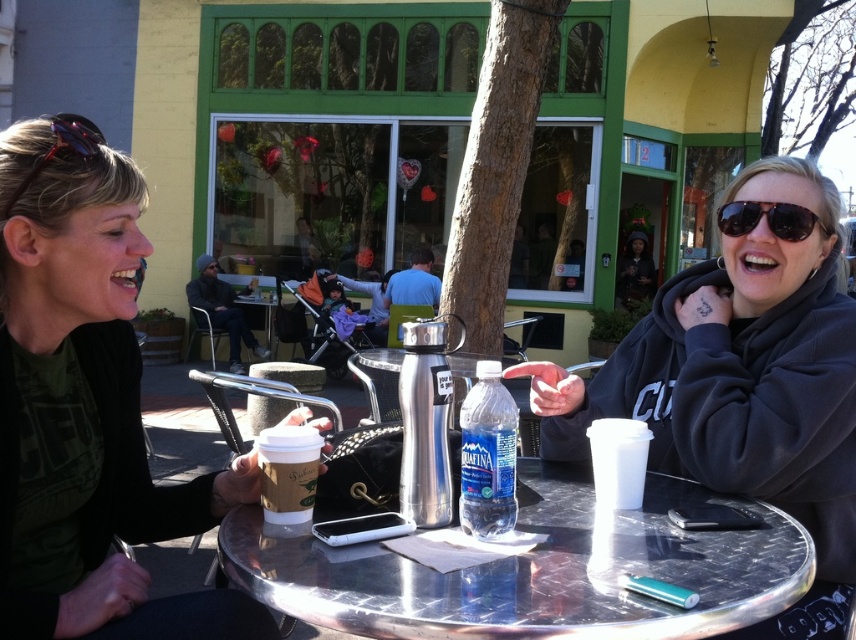
Looking at this image, who is shorter, matte black shirt at left or clear plastic bottle at center?

clear plastic bottle at center is shorter.

Who is positioned more to the left, matte black shirt at left or clear plastic bottle at center?

Positioned to the left is matte black shirt at left.

Is point (81, 269) farther from camera compared to point (498, 435)?

Yes, it is behind point (498, 435).

Identify the location of matte black shirt at left. (87, 406).

Is matte black shirt at left above matte paper cup at center?

Correct, matte black shirt at left is located above matte paper cup at center.

Which is behind, point (129, 196) or point (278, 522)?

Positioned behind is point (129, 196).

Locate an element on the screen. The height and width of the screenshot is (640, 856). matte black shirt at left is located at coordinates (87, 406).

Does matte black shirt at left appear over metallic silver table at center?

Correct, matte black shirt at left is located above metallic silver table at center.

Can you confirm if matte black shirt at left is thinner than metallic silver table at center?

Correct, matte black shirt at left's width is less than metallic silver table at center's.

Which is behind, point (100, 378) or point (779, 515)?

Point (100, 378)

The height and width of the screenshot is (640, 856). Identify the location of matte black shirt at left. (87, 406).